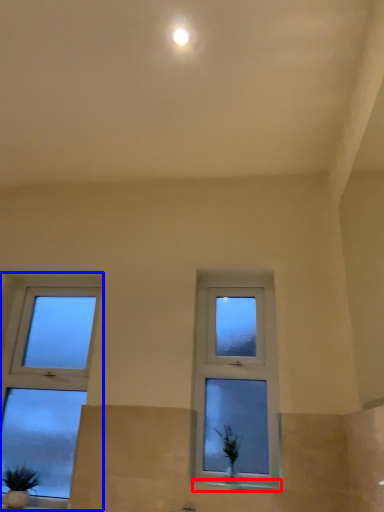
Question: Which point is further to the camera, window sill (highlighted by a red box) or window (highlighted by a blue box)?

Choices:
 (A) window sill
 (B) window

Answer: (B)